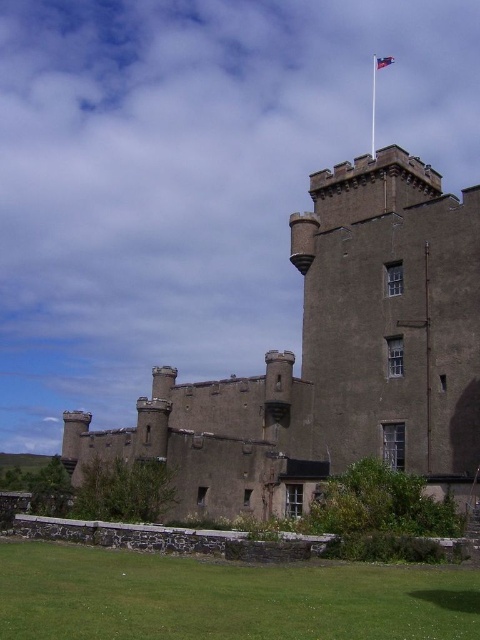
Which is in front, point (132, 449) or point (388, 60)?

Point (132, 449) is more forward.

Which is behind, point (332, 401) or point (393, 58)?

The point (393, 58) is more distant.

This screenshot has width=480, height=640. Describe the element at coordinates (334, 358) in the screenshot. I see `brown stone castle at center` at that location.

I want to click on brown stone castle at center, so click(334, 358).